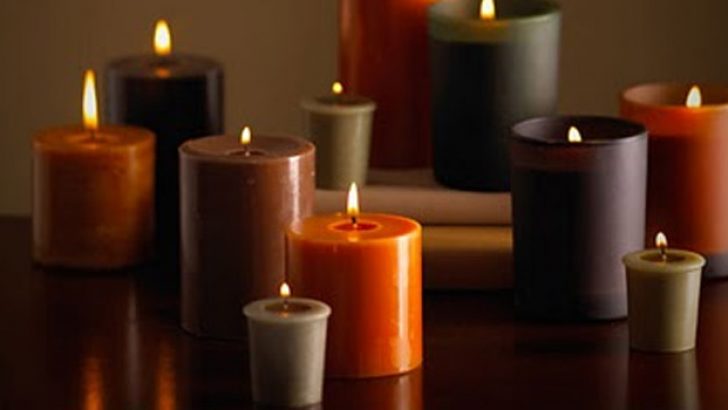
Locate an element on the screen. Image resolution: width=728 pixels, height=410 pixels. flames on the candles is located at coordinates (161, 36), (89, 104), (245, 136), (339, 88), (354, 195), (288, 291), (660, 243), (573, 132), (694, 100), (485, 4).